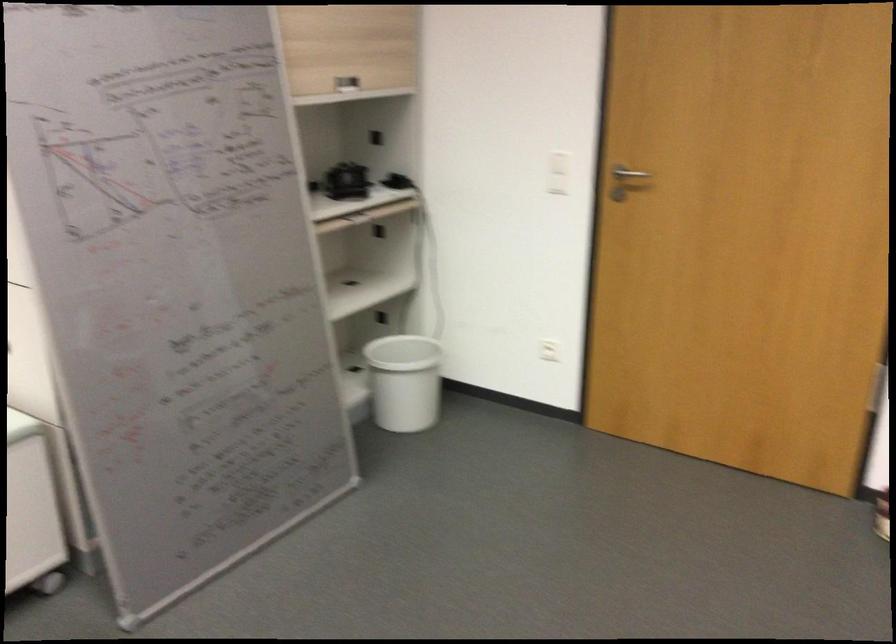
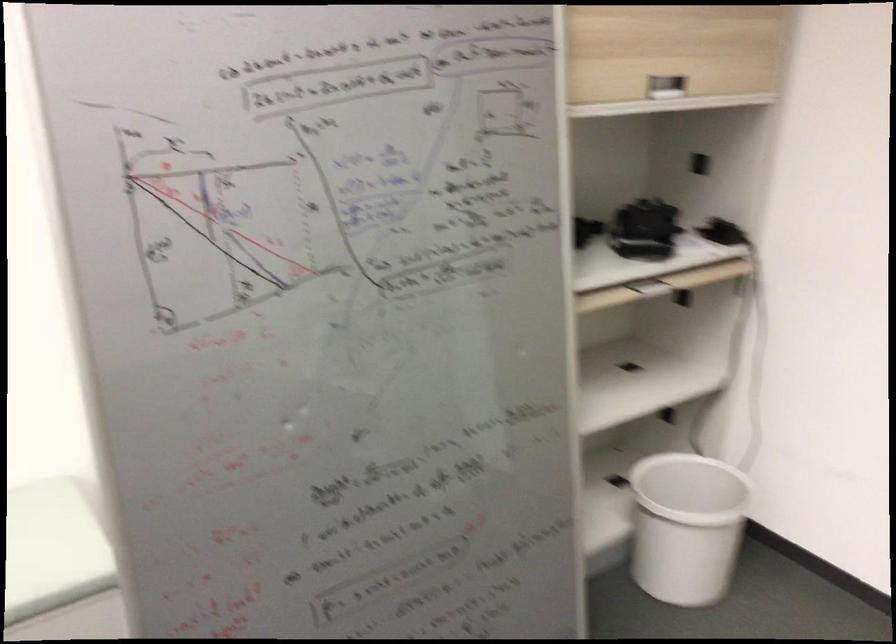
Find the pixel in the second image that matches (345,184) in the first image.

(643, 230)